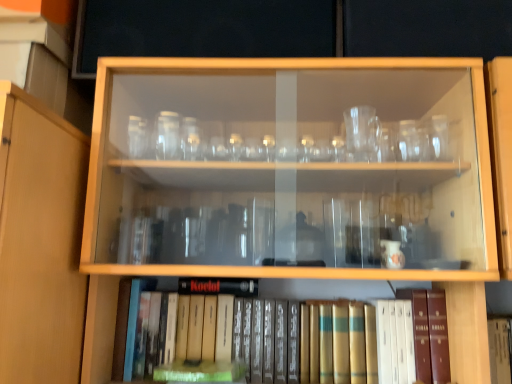
Identify the location of gold leather book at center. (286, 339).

Measure the distance between point (431,316) and camera.

Point (431,316) is 3.42 feet away from camera.

What is the approximate height of gold leather book at center?

The height of gold leather book at center is 8.47 inches.

This screenshot has width=512, height=384. Describe the element at coordinates (286, 339) in the screenshot. I see `gold leather book at center` at that location.

Identify the location of gold leather book at center. Image resolution: width=512 pixels, height=384 pixels. (286, 339).